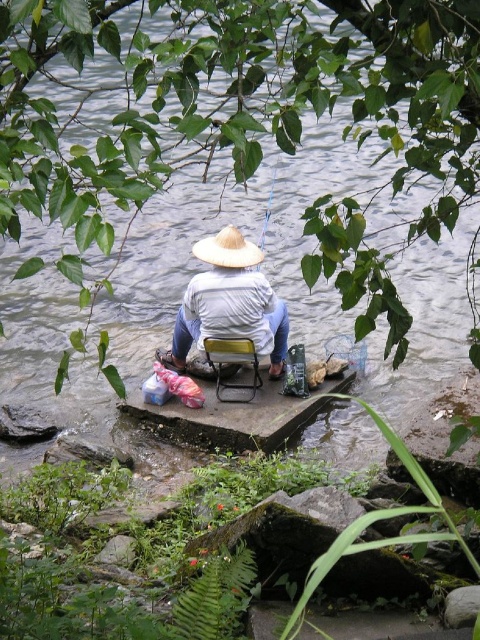
You are a photographer trying to capture the fisherman and his equipment. You notice the yellow plastic chair at center and the white straw hat at center. Which object is located to the left of the other?

The yellow plastic chair at center is positioned on the left side of white straw hat at center.

You are standing on the riverside platform and want to retrieve an item from the point labeled point (238, 344) and another item from point (217, 257). Which point will require you to move further back from the edge of the platform?

Point (238, 344) is behind point (217, 257), so retrieving the item from point (238, 344) will require moving further back from the edge of the platform.